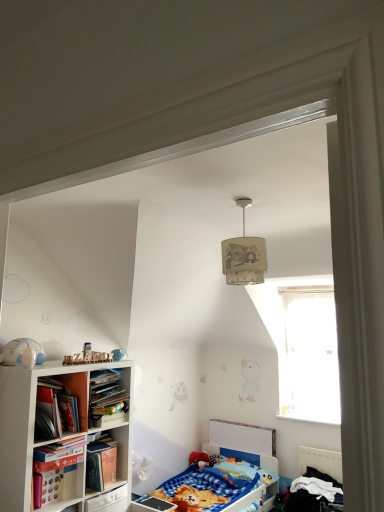
Question: Are transparent glass window at upper right and beige fabric lampshade at upper center located far from each other?

Choices:
 (A) yes
 (B) no

Answer: (A)

Question: From the image's perspective, would you say transparent glass window at upper right is shown under beige fabric lampshade at upper center?

Choices:
 (A) yes
 (B) no

Answer: (A)

Question: Is transparent glass window at upper right not within beige fabric lampshade at upper center?

Choices:
 (A) no
 (B) yes

Answer: (B)

Question: From a real-world perspective, is transparent glass window at upper right under beige fabric lampshade at upper center?

Choices:
 (A) yes
 (B) no

Answer: (A)

Question: Is transparent glass window at upper right oriented towards beige fabric lampshade at upper center?

Choices:
 (A) no
 (B) yes

Answer: (B)

Question: From the image's perspective, is transparent glass window at upper right over beige fabric lampshade at upper center?

Choices:
 (A) no
 (B) yes

Answer: (A)

Question: From a real-world perspective, is hardcover book at left, the 2th book from the bottom, physically below blue cotton bed at lower right, placed as the second bed when sorted from left to right?

Choices:
 (A) yes
 (B) no

Answer: (B)

Question: Is the position of hardcover book at left, the 2th book from the bottom, more distant than that of blue cotton bed at lower right, which is counted as the first bed, starting from the right?

Choices:
 (A) yes
 (B) no

Answer: (B)

Question: Can you confirm if hardcover book at left, acting as the first book starting from the top, is thinner than blue cotton bed at lower right, placed as the second bed when sorted from left to right?

Choices:
 (A) yes
 (B) no

Answer: (A)

Question: Is hardcover book at left, acting as the first book starting from the top, smaller than blue cotton bed at lower right, placed as the second bed when sorted from left to right?

Choices:
 (A) no
 (B) yes

Answer: (B)

Question: Is hardcover book at left, the 2th book from the bottom, oriented towards blue cotton bed at lower right, placed as the second bed when sorted from left to right?

Choices:
 (A) no
 (B) yes

Answer: (A)

Question: From the image's perspective, is hardcover book at left, acting as the first book starting from the top, above blue cotton bed at lower right, placed as the second bed when sorted from left to right?

Choices:
 (A) no
 (B) yes

Answer: (B)

Question: Is blue cotton bed at lower right, which is counted as the first bed, starting from the right, behind white matte toy at left?

Choices:
 (A) yes
 (B) no

Answer: (A)